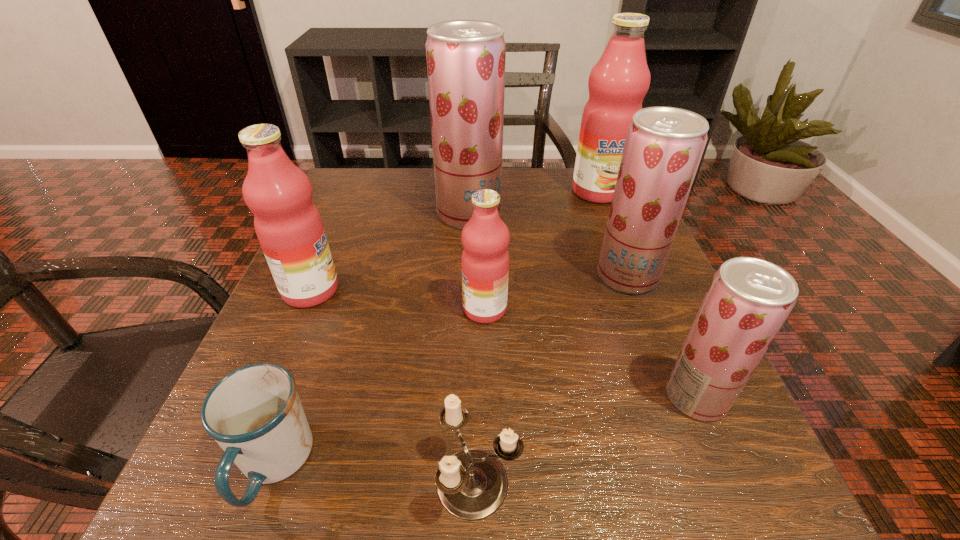
The width and height of the screenshot is (960, 540). In order to click on free space at the right edge of the desktop in this screenshot , I will do `click(659, 322)`.

Where is `blank region between the candle holder and the second pink fruit juice from left to right`? Image resolution: width=960 pixels, height=540 pixels. blank region between the candle holder and the second pink fruit juice from left to right is located at coordinates (481, 396).

The height and width of the screenshot is (540, 960). I want to click on free space between the nearest strawberry fruit juice and the white mug, so click(x=485, y=431).

You are a GUI agent. You are given a task and a screenshot of the screen. Output one action in this format:
    pyautogui.click(x=<x>, y=<y>)
    Task: Click on the free space between the second biggest strawberry fruit juice and the mug
    
    Given the screenshot: What is the action you would take?
    pyautogui.click(x=450, y=370)

You are a GUI agent. You are given a task and a screenshot of the screen. Output one action in this format:
    pyautogui.click(x=<x>, y=<y>)
    Task: Click on the vacant area that lies between the second nearest strawberry fruit juice and the nearest fruit juice
    
    Given the screenshot: What is the action you would take?
    pyautogui.click(x=661, y=336)

At what (x,y) coordinates should I click in order to perform the action: click on free spot between the nearest strawberry fruit juice and the biggest pink fruit juice. Please return your answer as a coordinate pair (x, y). The height and width of the screenshot is (540, 960). Looking at the image, I should click on (647, 294).

Find the location of a particular element. free space between the nearest fruit juice and the leftmost pink fruit juice is located at coordinates (504, 343).

Identify the location of free space between the mug and the second pink fruit juice from right to left. This screenshot has height=540, width=960. (379, 387).

I want to click on free spot between the second biggest strawberry fruit juice and the nearest strawberry fruit juice, so click(x=661, y=336).

I want to click on vacant space that's between the farthest pink fruit juice and the leftmost fruit juice, so click(454, 241).